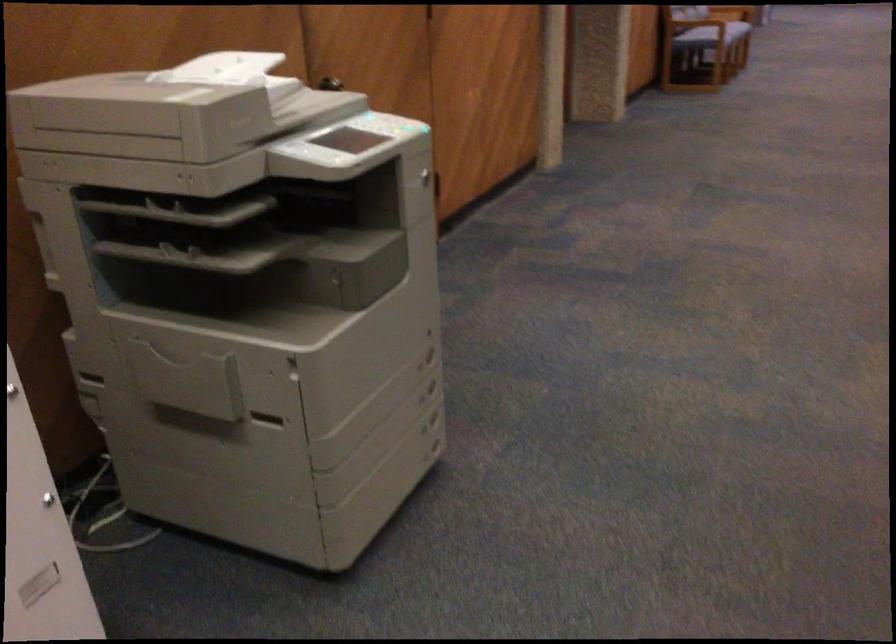
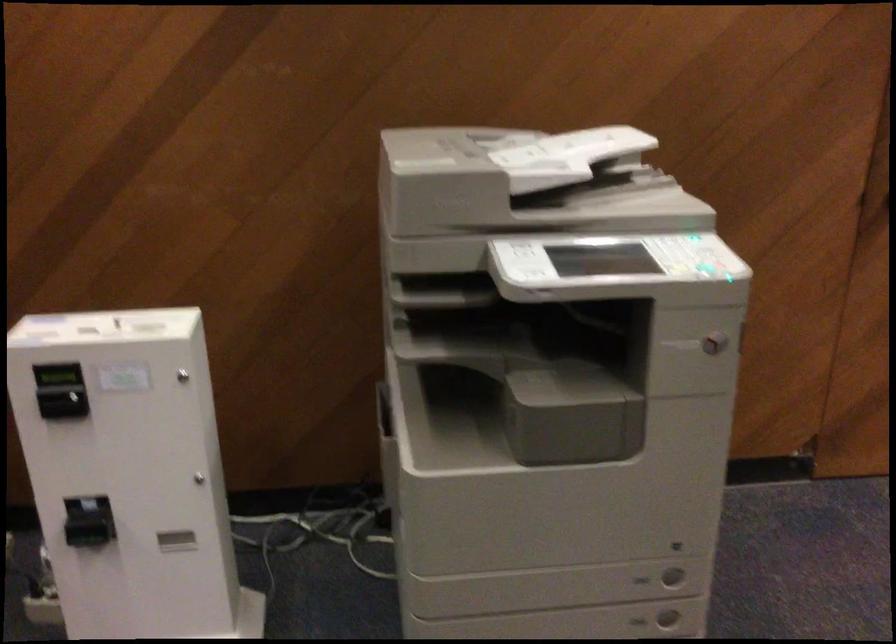
Where in the second image is the point corresponding to [431,402] from the first image?

(638, 621)